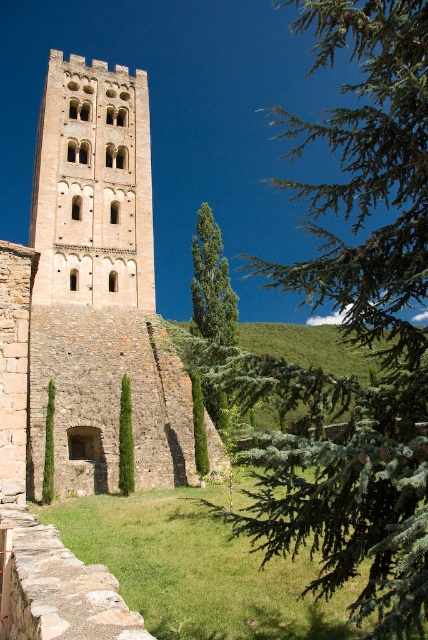
You are an architect analyzing the image of the historic site. You need to determine which structure occupies more visual space in the scene between the green leafy tree at upper right and the beige stone tower at center. Based on the provided information, which one is larger?

The green leafy tree at upper right is larger in size than the beige stone tower at center, so it occupies more visual space in the scene.

You are standing at the base of the historic stone tower and want to take a photo of the green leafy tree at upper right. Based on its 2D location coordinates, where should you position yourself to ensure the tree is centered in your camera viewfinder?

The green leafy tree at upper right is located at coordinates 0.517 on the x axis and 0.832 on the y axis, so to center it in your camera viewfinder, you should position yourself slightly to the left and lower your angle slightly to align with those coordinates.

You are standing in front of the historic stone tower and want to take a photo. You notice two points marked in the scene. Which point, point (x=107, y=266) or point (x=193, y=252), is closer to your camera lens?

Point (x=107, y=266) is closer to the camera than point (x=193, y=252).